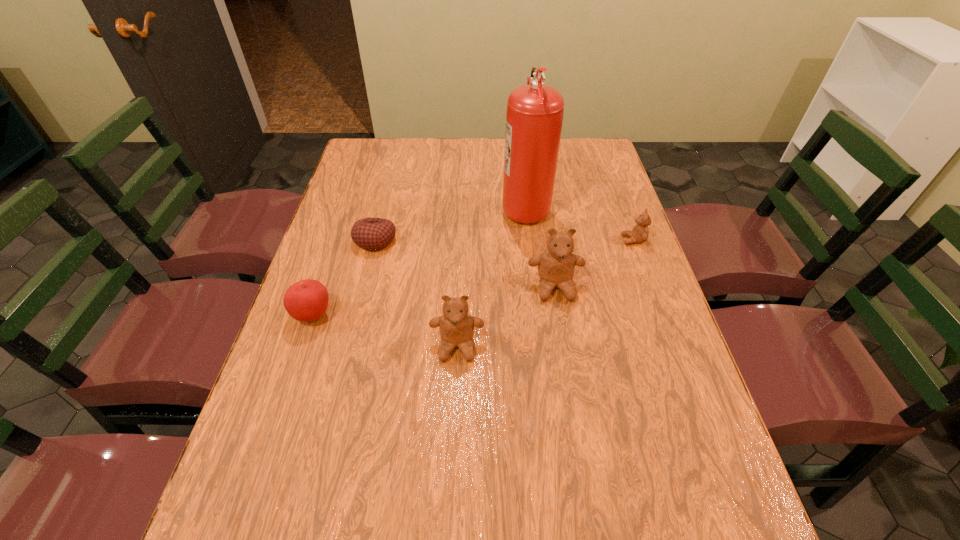
Locate an element on the screen. vacant space located 0.160m on the face of the rightmost object is located at coordinates (566, 240).

At what (x,y) coordinates should I click in order to perform the action: click on vacant region located on the face of the rightmost object. Please return your answer as a coordinate pair (x, y). This screenshot has width=960, height=540. Looking at the image, I should click on (549, 240).

This screenshot has width=960, height=540. Identify the location of vacant area located on the face of the rightmost object. (532, 240).

Locate an element on the screen. The height and width of the screenshot is (540, 960). vacant point located 0.350m on the instruction side of the tallest object is located at coordinates [390, 206].

Where is `free spot located 0.380m on the instruction side of the tallest object`? The height and width of the screenshot is (540, 960). free spot located 0.380m on the instruction side of the tallest object is located at coordinates (380, 206).

This screenshot has height=540, width=960. Find the location of `vacant space located 0.180m on the instruction side of the tallest object`. vacant space located 0.180m on the instruction side of the tallest object is located at coordinates (444, 206).

Identify the location of free space located 0.370m on the right of the beanbag. click(525, 240).

Find the location of a particular element. The height and width of the screenshot is (540, 960). free space located on the front of the apple is located at coordinates (282, 406).

You are a GUI agent. You are given a task and a screenshot of the screen. Output one action in this format:
    pyautogui.click(x=<x>, y=<y>)
    Task: Click on the beanbag present at the left edge
    Image resolution: width=960 pixels, height=540 pixels.
    Given the screenshot: What is the action you would take?
    pyautogui.click(x=373, y=234)

This screenshot has width=960, height=540. I want to click on apple present at the left edge, so click(307, 300).